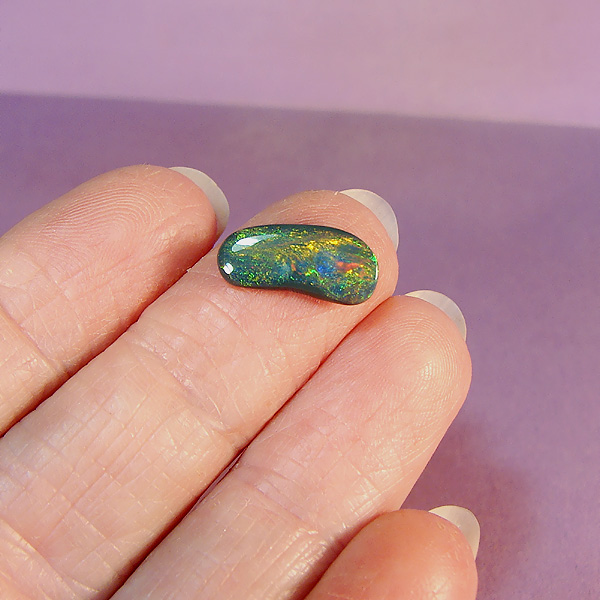
Locate an element on the screen. The image size is (600, 600). wall is located at coordinates (361, 67).